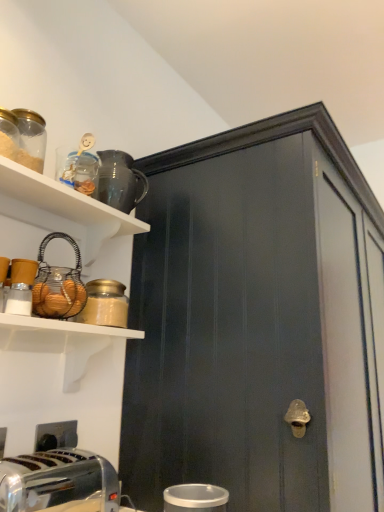
Question: Considering the relative sizes of polished chrome toaster at lower left and matte black cabinet at center in the image provided, is polished chrome toaster at lower left taller than matte black cabinet at center?

Choices:
 (A) yes
 (B) no

Answer: (B)

Question: Can you confirm if polished chrome toaster at lower left is positioned to the left of matte black cabinet at center?

Choices:
 (A) yes
 (B) no

Answer: (A)

Question: Is polished chrome toaster at lower left not within matte black cabinet at center?

Choices:
 (A) yes
 (B) no

Answer: (A)

Question: Is polished chrome toaster at lower left positioned behind matte black cabinet at center?

Choices:
 (A) no
 (B) yes

Answer: (A)

Question: From a real-world perspective, is polished chrome toaster at lower left on top of matte black cabinet at center?

Choices:
 (A) no
 (B) yes

Answer: (A)

Question: Is polished chrome toaster at lower left taller or shorter than wire basket at upper left, which appears as the 2th appliance when viewed from the back?

Choices:
 (A) tall
 (B) short

Answer: (B)

Question: In the image, is polished chrome toaster at lower left positioned in front of or behind wire basket at upper left, the 1th appliance when ordered from left to right?

Choices:
 (A) behind
 (B) front

Answer: (B)

Question: Looking at the image, does polished chrome toaster at lower left seem bigger or smaller compared to wire basket at upper left, which is counted as the second appliance, starting from the bottom?

Choices:
 (A) small
 (B) big

Answer: (B)

Question: Visually, is polished chrome toaster at lower left positioned to the left or to the right of wire basket at upper left, acting as the 3th appliance starting from the right?

Choices:
 (A) left
 (B) right

Answer: (A)

Question: From a real-world perspective, relative to glossy ceramic pitcher at upper center, the 3th appliance when ordered from bottom to top, is wire basket at upper left, which is counted as the second appliance, starting from the bottom, vertically above or below?

Choices:
 (A) below
 (B) above

Answer: (A)

Question: In terms of width, does wire basket at upper left, which is counted as the second appliance, starting from the bottom, look wider or thinner when compared to glossy ceramic pitcher at upper center, which is counted as the first appliance, starting from the top?

Choices:
 (A) wide
 (B) thin

Answer: (A)

Question: Does point (49, 289) appear closer or farther from the camera than point (129, 212)?

Choices:
 (A) farther
 (B) closer

Answer: (B)

Question: Is wire basket at upper left, the 2th appliance from the top, to the left or to the right of glossy ceramic pitcher at upper center, the 2th appliance when ordered from left to right, in the image?

Choices:
 (A) right
 (B) left

Answer: (B)

Question: From the image's perspective, is matte black cabinet at center located above or below glossy ceramic pitcher at upper center, placed as the third appliance when sorted from front to back?

Choices:
 (A) above
 (B) below

Answer: (B)

Question: Would you say matte black cabinet at center is inside or outside glossy ceramic pitcher at upper center, the 2th appliance when ordered from left to right?

Choices:
 (A) outside
 (B) inside

Answer: (A)